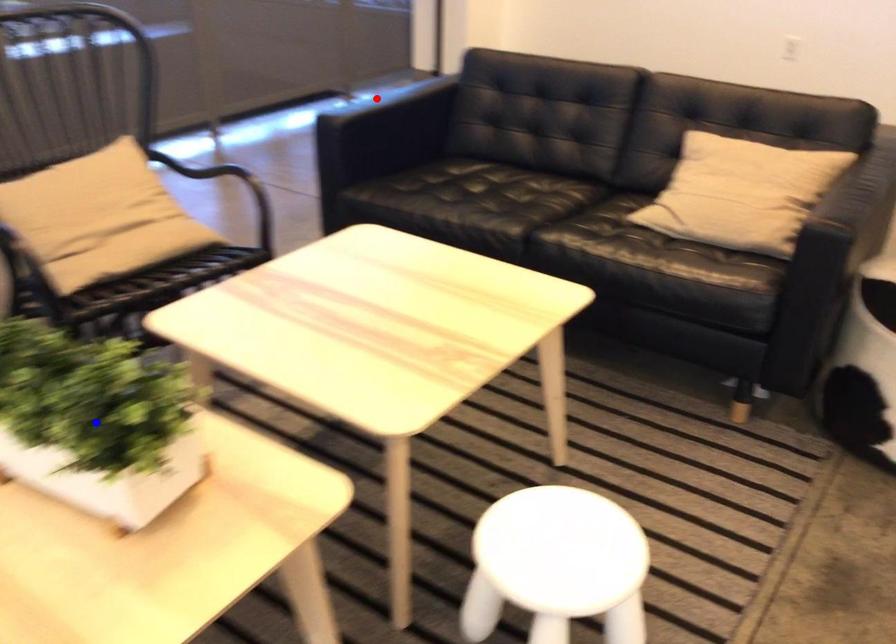
Question: Two points are marked on the image. Which point is closer to the camera?

Choices:
 (A) Blue point is closer.
 (B) Red point is closer.

Answer: (A)